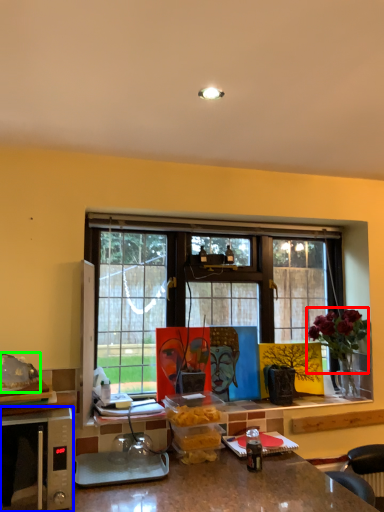
Question: Which object is positioned farthest from flower (highlighted by a red box)? Select from microwave oven (highlighted by a blue box) and food (highlighted by a green box).

Choices:
 (A) microwave oven
 (B) food

Answer: (B)